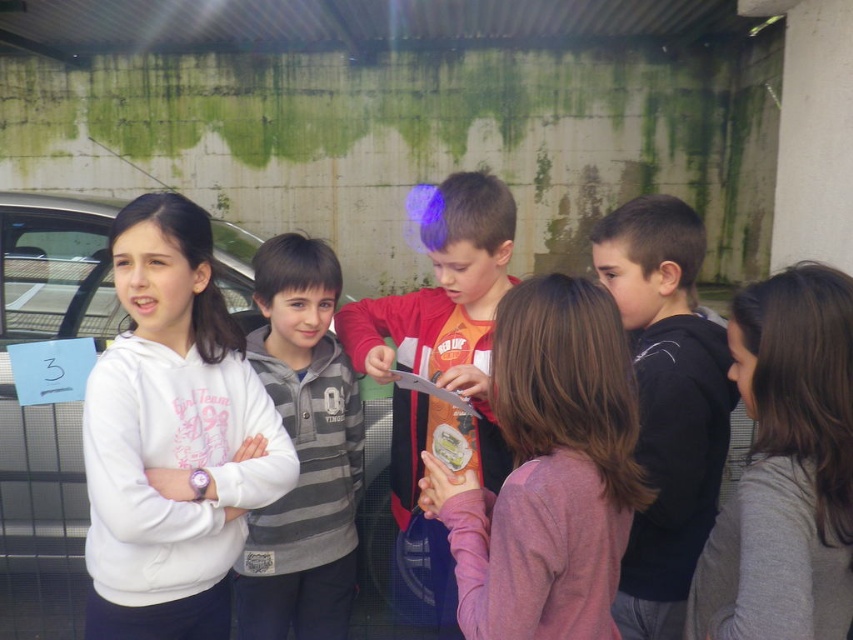
Is gray matte sweater at center bigger than red shirt at center?

No.

Is gray matte sweater at center closer to camera compared to red shirt at center?

Yes, gray matte sweater at center is closer to the viewer.

Between point (761, 426) and point (508, 248), which one is positioned in front?

Point (761, 426)

Find the location of a particular element. gray matte sweater at center is located at coordinates (786, 468).

In the scene shown: Who is higher up, orange cotton shirt at center or gray matte sweater at center?

gray matte sweater at center is higher up.

Which is more to the right, orange cotton shirt at center or gray matte sweater at center?

Positioned to the right is gray matte sweater at center.

Find the location of a particular element. orange cotton shirt at center is located at coordinates (548, 472).

Which is above, gray matte sweater at center or black matte hoodie at center?

Positioned higher is black matte hoodie at center.

Does gray matte sweater at center appear on the right side of black matte hoodie at center?

Indeed, gray matte sweater at center is positioned on the right side of black matte hoodie at center.

Between point (734, 627) and point (692, 381), which one is positioned in front?

Point (734, 627) is more forward.

Image resolution: width=853 pixels, height=640 pixels. Identify the location of gray matte sweater at center. (786, 468).